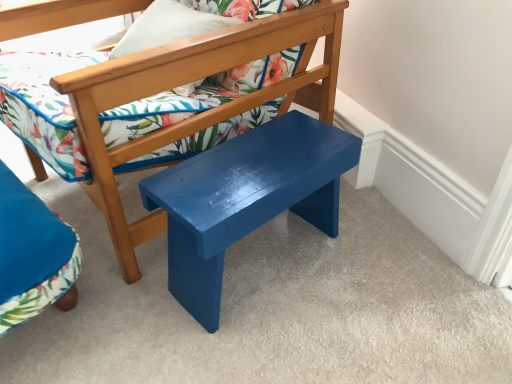
Question: Is matte floral pillow at upper center inside the boundaries of velvet blue chair at lower left, placed as the 2th chair when sorted from top to bottom, or outside?

Choices:
 (A) inside
 (B) outside

Answer: (B)

Question: Is matte floral pillow at upper center to the left or to the right of velvet blue chair at lower left, placed as the 2th chair when sorted from top to bottom, in the image?

Choices:
 (A) right
 (B) left

Answer: (A)

Question: Which object is the closest to the velvet blue chair at lower left, which appears as the 1th chair when ordered from the bottom?

Choices:
 (A) glossy wood stool at center
 (B) matte floral pillow at upper center
 (C) matte blue bench at center, which is counted as the 1th chair, starting from the top

Answer: (C)

Question: Which of these objects is positioned closest to the matte blue bench at center, arranged as the 2th chair when ordered from the bottom?

Choices:
 (A) glossy wood stool at center
 (B) matte floral pillow at upper center
 (C) velvet blue chair at lower left, which appears as the 1th chair when ordered from the bottom

Answer: (A)